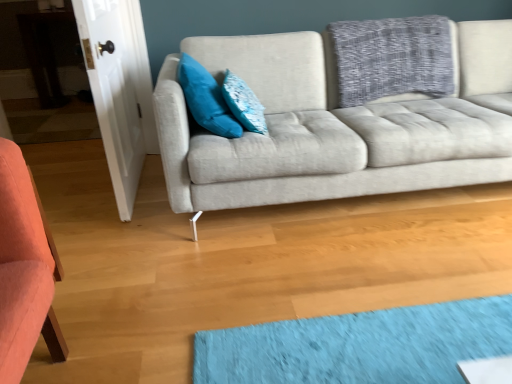
Question: Could you tell me if teal velvet pillow at upper left, placed as the second pillow when sorted from right to left, is turned towards white wood door at left?

Choices:
 (A) yes
 (B) no

Answer: (B)

Question: Can you confirm if teal velvet pillow at upper left, the first pillow from the left, is taller than white wood door at left?

Choices:
 (A) yes
 (B) no

Answer: (B)

Question: Is teal velvet pillow at upper left, placed as the second pillow when sorted from right to left, smaller than white wood door at left?

Choices:
 (A) no
 (B) yes

Answer: (B)

Question: Does teal velvet pillow at upper left, the first pillow from the left, have a larger size compared to white wood door at left?

Choices:
 (A) yes
 (B) no

Answer: (B)

Question: Can you confirm if teal velvet pillow at upper left, placed as the second pillow when sorted from right to left, is wider than white wood door at left?

Choices:
 (A) no
 (B) yes

Answer: (B)

Question: Does teal velvet pillow at upper left, the first pillow from the left, come behind white wood door at left?

Choices:
 (A) no
 (B) yes

Answer: (B)

Question: Is textured blue pillow at center, the 2th pillow positioned from the left, located within teal velvet pillow at upper left, the first pillow from the left?

Choices:
 (A) no
 (B) yes

Answer: (B)

Question: Is teal velvet pillow at upper left, the first pillow from the left, behind textured blue pillow at center, the 2th pillow positioned from the left?

Choices:
 (A) no
 (B) yes

Answer: (A)

Question: Does teal velvet pillow at upper left, placed as the second pillow when sorted from right to left, have a lesser width compared to textured blue pillow at center, acting as the 1th pillow starting from the right?

Choices:
 (A) yes
 (B) no

Answer: (B)

Question: Does teal velvet pillow at upper left, the first pillow from the left, turn towards textured blue pillow at center, the 2th pillow positioned from the left?

Choices:
 (A) yes
 (B) no

Answer: (A)

Question: Can you confirm if teal velvet pillow at upper left, the first pillow from the left, is smaller than textured blue pillow at center, the 2th pillow positioned from the left?

Choices:
 (A) no
 (B) yes

Answer: (A)

Question: Can you confirm if teal velvet pillow at upper left, placed as the second pillow when sorted from right to left, is positioned to the right of textured blue pillow at center, acting as the 1th pillow starting from the right?

Choices:
 (A) no
 (B) yes

Answer: (A)

Question: Is textured blue pillow at center, acting as the 1th pillow starting from the right, behind teal velvet pillow at upper left, the first pillow from the left?

Choices:
 (A) no
 (B) yes

Answer: (B)